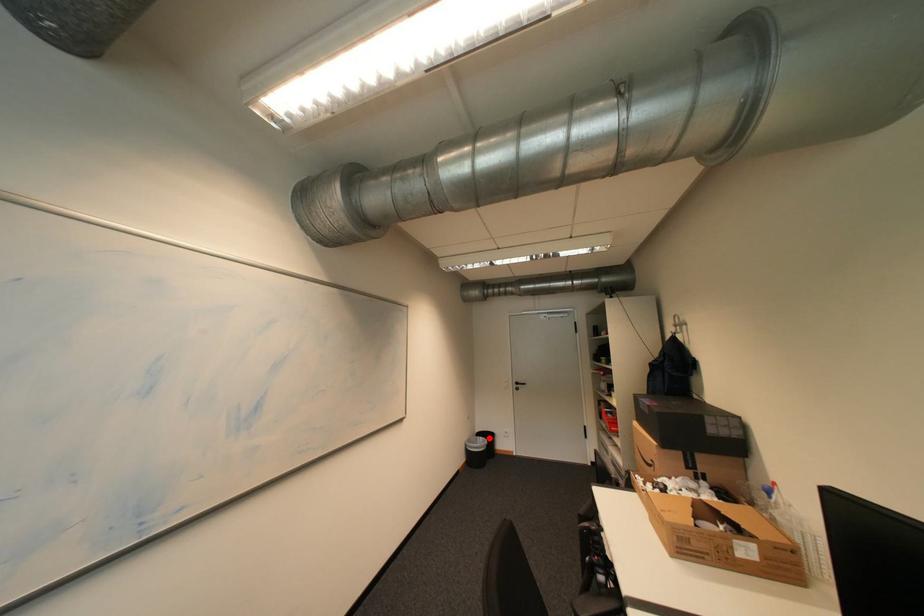
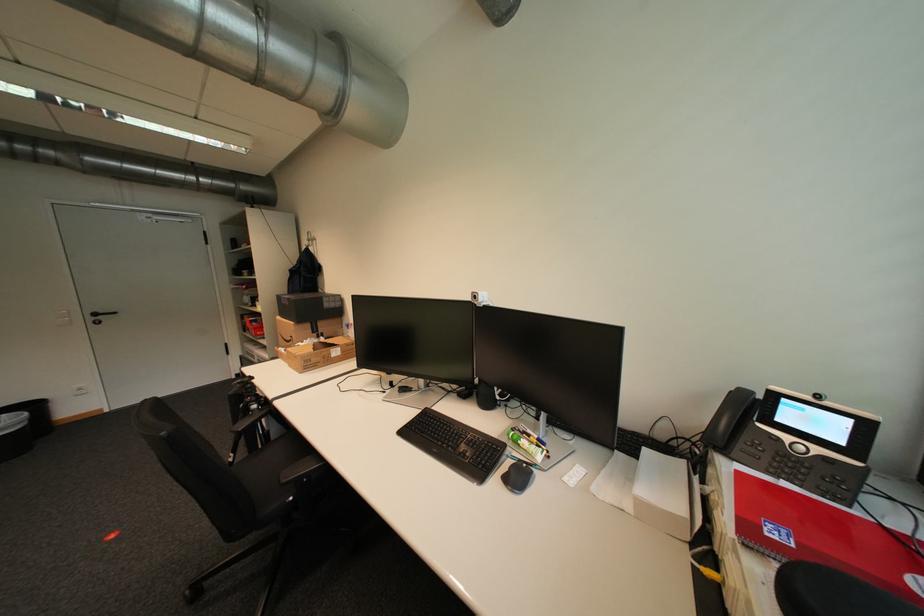
In the second image, find the point that corresponds to the highlighted location in the first image.

(11, 416)